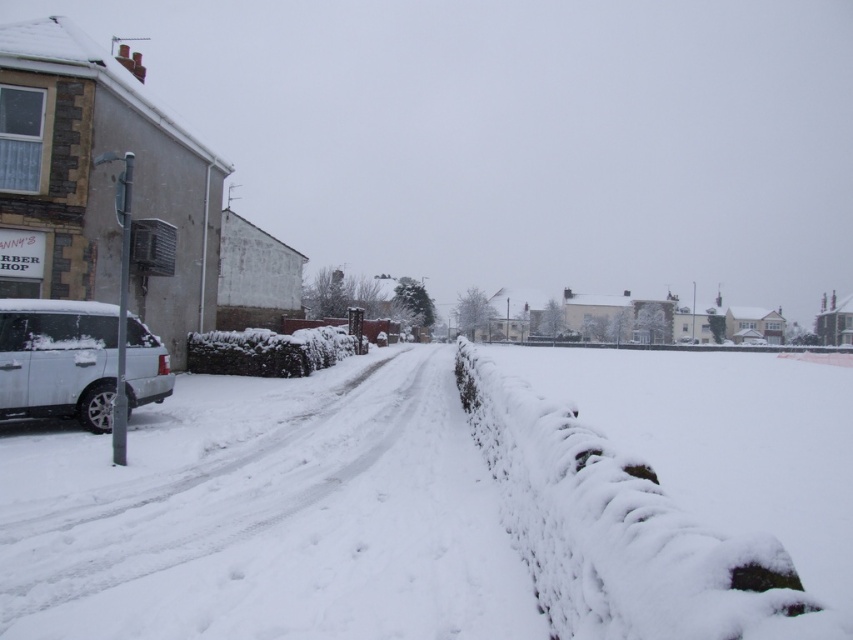
You are standing at the camera position looking at the snowy street. There are two points marked on the image, one at coordinate point (22, 611) and another at point (56, 401). Which of these two points is nearer to you?

Point (22, 611) is closer to the camera than point (56, 401).

You are a snowplow operator who needs to clear the snow from the street. The snowplow has a maximum reach of 2 meters. Can you reach the white fluffy snow at center from your current position?

The distance between you and the white fluffy snow at center is 2.10 meters, which exceeds the snowplow machine reach of 2 meters. Therefore, you cannot reach the white fluffy snow at center with the snowplow.

You are a delivery person trying to reach the address located near the ANNY S BARBER SHOP. You see the white fluffy snow at center and the sleek silver suv at left. Which object is closer to the ANNY S BARBER SHOP sign?

The sleek silver suv at left is closer to the ANNY S BARBER SHOP sign because it is positioned on the left side of the white fluffy snow at center, which is near the building with the sign.